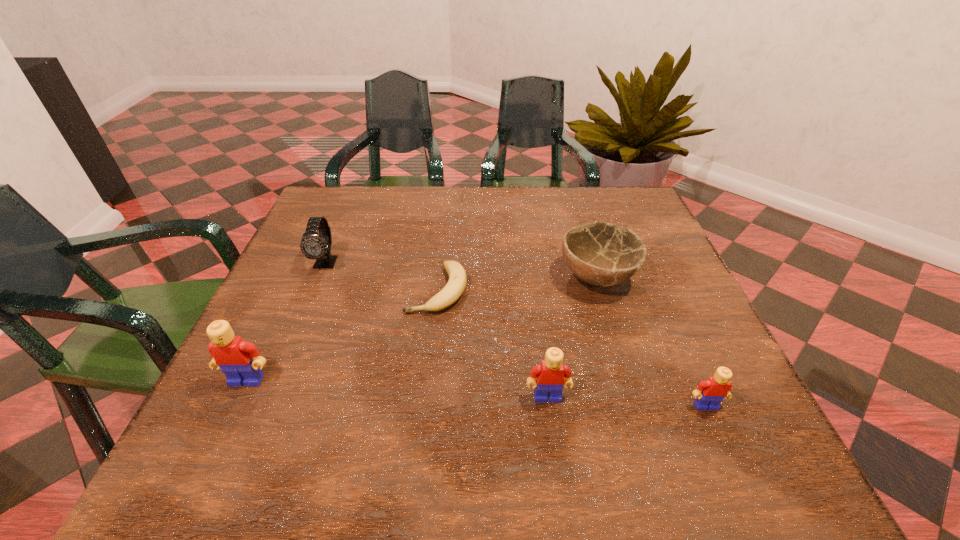
I want to click on vacant position for inserting another Lego evenly, so click(395, 389).